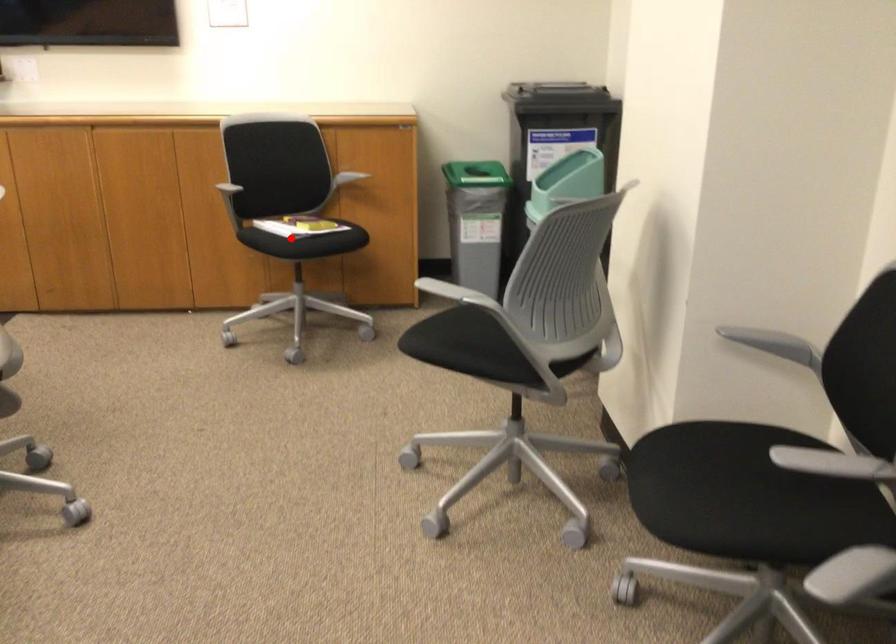
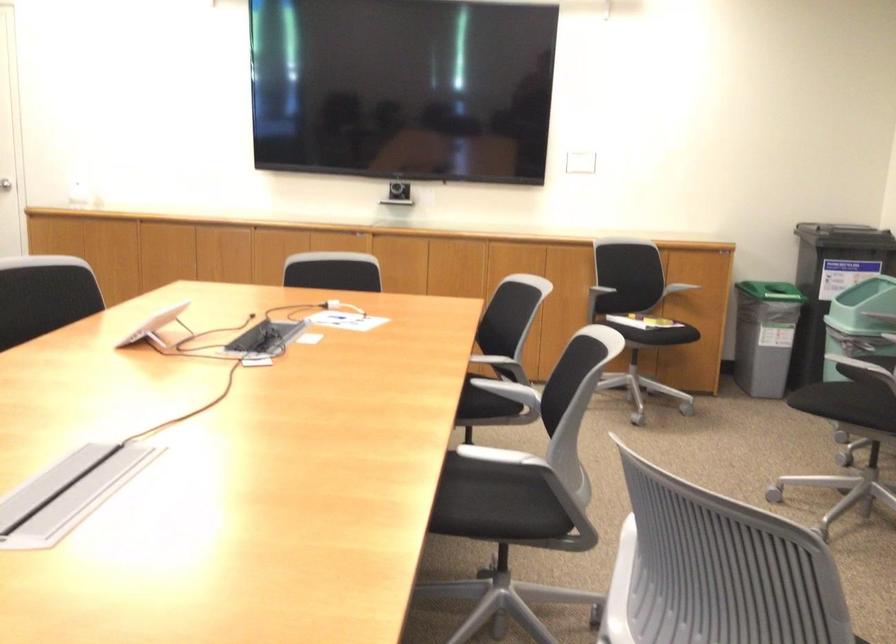
The point at the highlighted location is marked in the first image. Where is the corresponding point in the second image?

(636, 313)